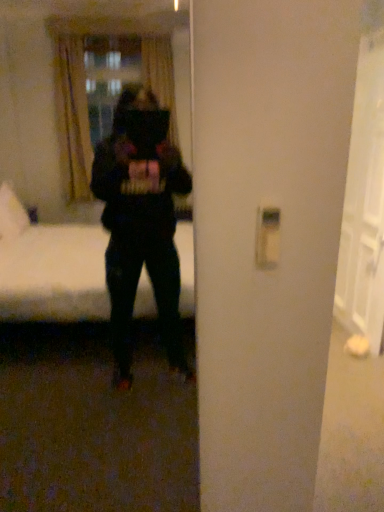
Question: In the image, is white plastic light switch at right positioned in front of or behind white glossy door at right?

Choices:
 (A) behind
 (B) front

Answer: (B)

Question: In terms of height, does white plastic light switch at right look taller or shorter compared to white glossy door at right?

Choices:
 (A) short
 (B) tall

Answer: (A)

Question: Which is farther from the black matte mirror at center?

Choices:
 (A) white glossy door at right
 (B) white plastic light switch at right

Answer: (B)

Question: Considering the real-world distances, which object is closest to the black matte mirror at center?

Choices:
 (A) white glossy door at right
 (B) white plastic light switch at right

Answer: (A)